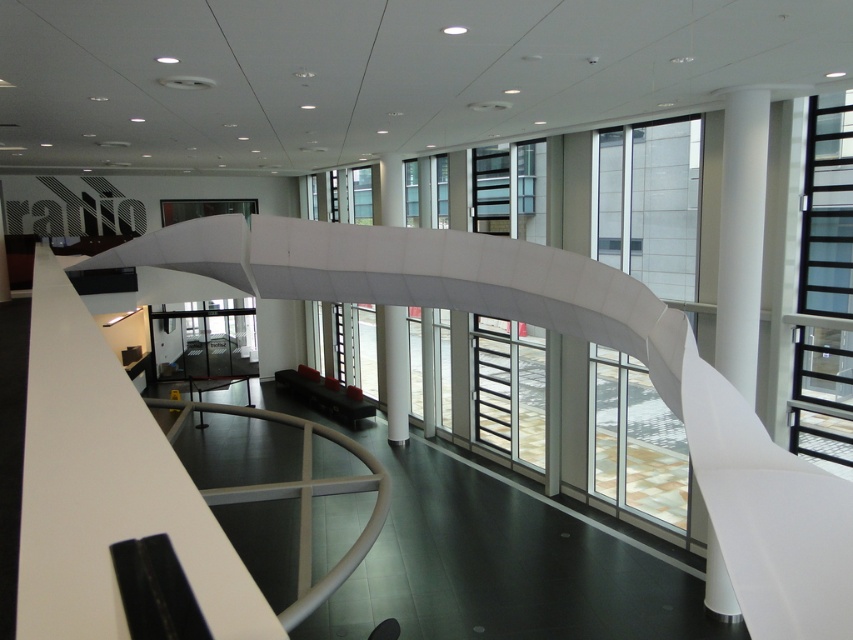
Question: Is white smooth column at right below white glossy pillar at center?

Choices:
 (A) yes
 (B) no

Answer: (B)

Question: Is white smooth column at right in front of white glossy pillar at center?

Choices:
 (A) no
 (B) yes

Answer: (B)

Question: Which point is farther to the camera?

Choices:
 (A) white smooth column at right
 (B) white glossy pillar at center

Answer: (B)

Question: Which point is farther to the camera?

Choices:
 (A) white glossy pillar at center
 (B) white smooth column at right

Answer: (A)

Question: Is white smooth column at right below white glossy pillar at center?

Choices:
 (A) no
 (B) yes

Answer: (A)